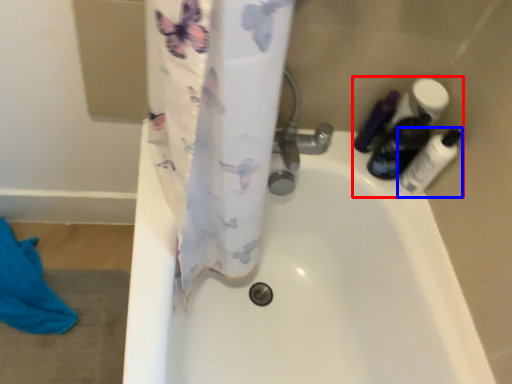
Question: Which point is closer to the camera, toiletry (highlighted by a red box) or toiletry (highlighted by a blue box)?

Choices:
 (A) toiletry
 (B) toiletry

Answer: (B)